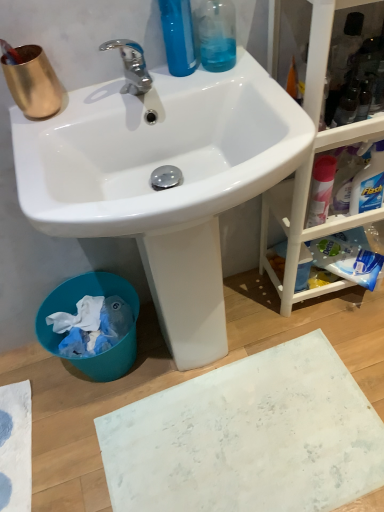
Locate an element on the screen. This screenshot has width=384, height=512. space that is in front of gold metallic cup at upper left is located at coordinates (37, 136).